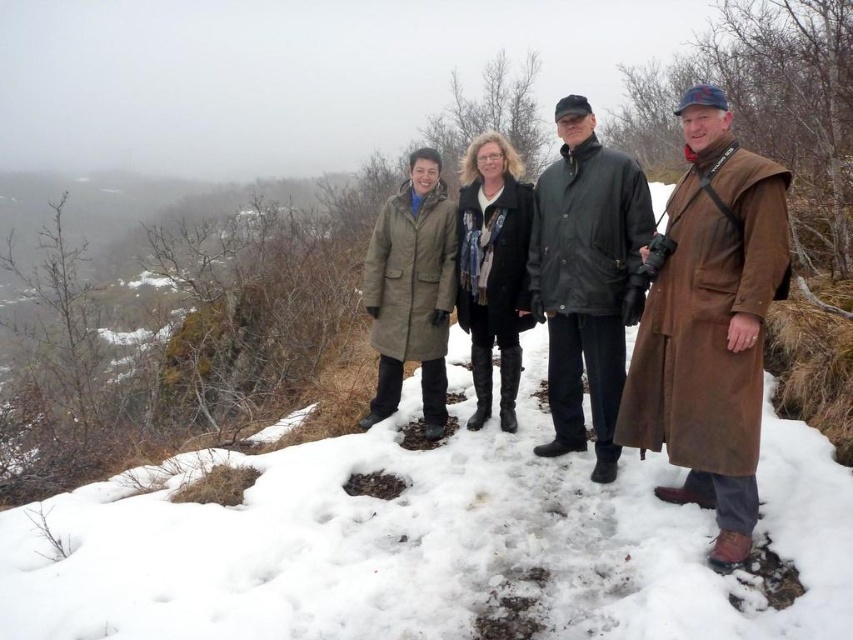
Question: Observing the image, what is the correct spatial positioning of brown leather coat at right in reference to dark green leather jacket at center?

Choices:
 (A) right
 (B) left

Answer: (A)

Question: Does matte brown coat at center have a greater width compared to brown leather coat at right?

Choices:
 (A) yes
 (B) no

Answer: (A)

Question: Which of the following is the closest to the observer?

Choices:
 (A) (683, 600)
 (B) (583, 122)
 (C) (699, 435)

Answer: (A)

Question: Which object is closer to the camera taking this photo?

Choices:
 (A) white powdery snow at center
 (B) brown leather coat at right

Answer: (A)

Question: Is brown leather coat at right positioned at the back of dark green leather jacket at center?

Choices:
 (A) no
 (B) yes

Answer: (A)

Question: Which object is the farthest from the brown leather coat at right?

Choices:
 (A) white powdery snow at center
 (B) matte brown coat at center

Answer: (A)